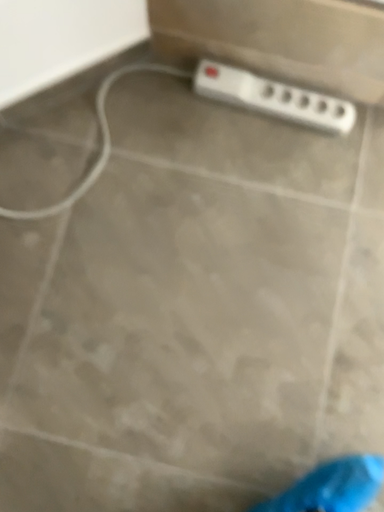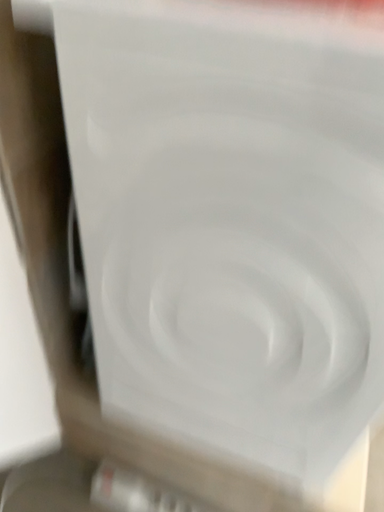
Question: Which way did the camera rotate in the video?

Choices:
 (A) rotated downward
 (B) rotated upward

Answer: (B)